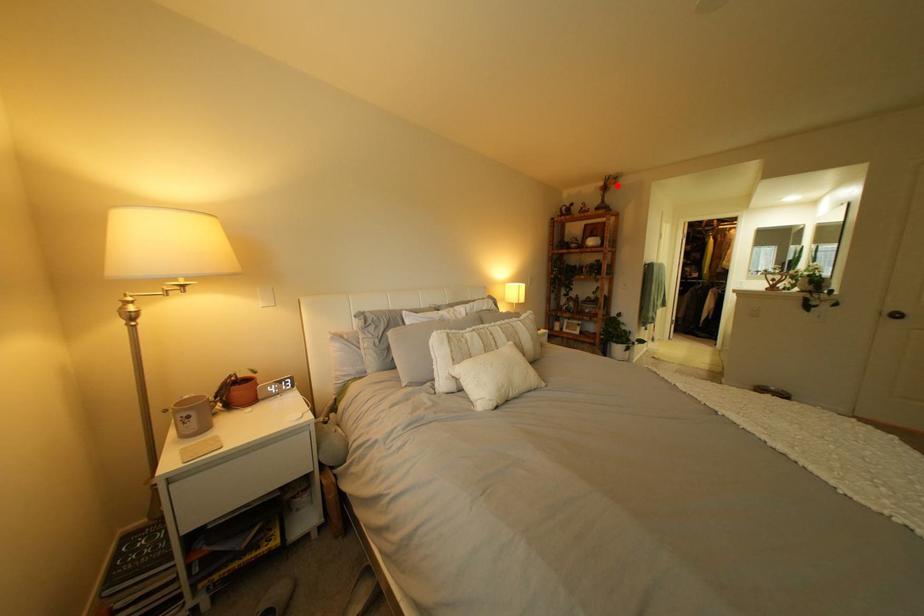
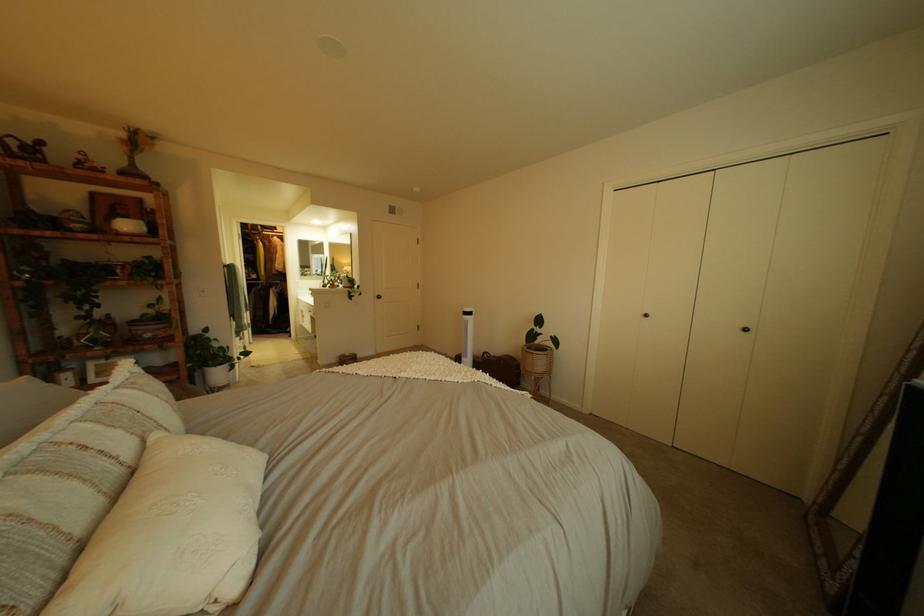
Question: I am providing you with two images of the same scene from different viewpoints. Image1 has a red point marked. In image2, the corresponding 3D location appears at what relative position? Reply with the corresponding letter.

Choices:
 (A) Closer
 (B) Farther

Answer: (B)